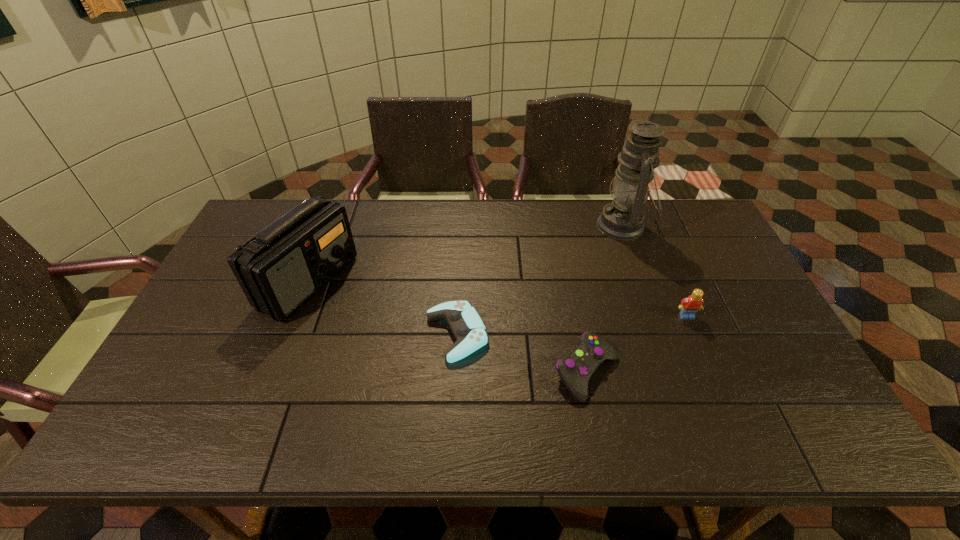
In order to click on the tallest object in this screenshot , I will do `click(623, 219)`.

What are the coordinates of `radio receiver` in the screenshot? It's located at (279, 269).

Where is `the leftmost object`? The image size is (960, 540). the leftmost object is located at coordinates (279, 269).

What are the coordinates of `the third shortest object` in the screenshot? It's located at (689, 306).

The image size is (960, 540). In order to click on the third object from left to right in this screenshot , I will do click(575, 370).

The height and width of the screenshot is (540, 960). In order to click on the second shortest object in this screenshot , I will do `click(575, 370)`.

At what (x,y) coordinates should I click in order to perform the action: click on the fourth object from right to left. Please return your answer as a coordinate pair (x, y). Looking at the image, I should click on (465, 323).

Locate an element on the screen. Image resolution: width=960 pixels, height=540 pixels. the shorter control is located at coordinates (465, 323).

Image resolution: width=960 pixels, height=540 pixels. What are the coordinates of `free location located 0.280m on the left of the tallest object` in the screenshot? It's located at (516, 226).

Locate an element on the screen. vacant region located on the front panel of the radio receiver is located at coordinates (444, 282).